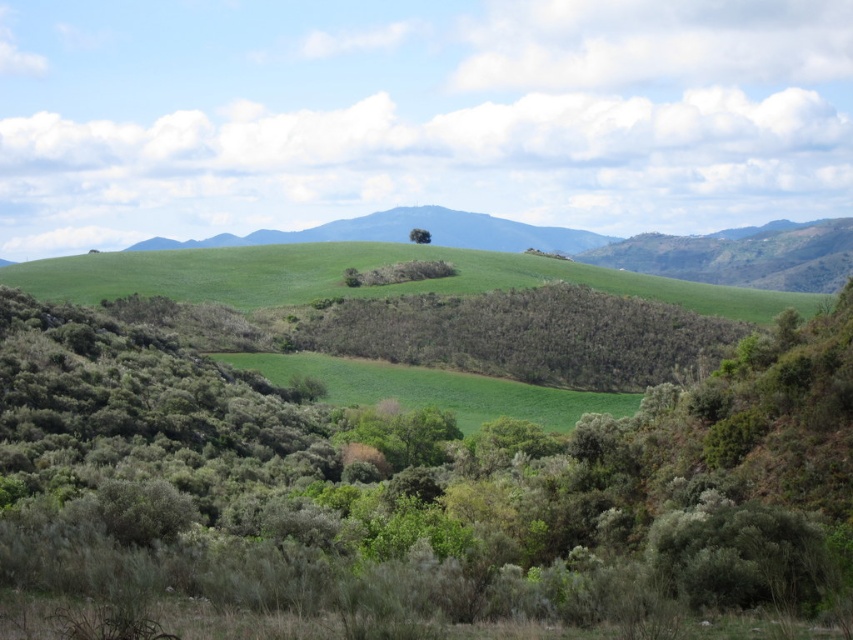
Question: Which of the following is the farthest from the observer?

Choices:
 (A) green leafy tree at center
 (B) green grassy hill at center
 (C) green leafy shrub at center
 (D) green grassy field at center

Answer: (B)

Question: Is green leafy shrub at center bigger than green grassy field at center?

Choices:
 (A) yes
 (B) no

Answer: (A)

Question: Can you confirm if green leafy shrub at center is positioned above green grassy field at center?

Choices:
 (A) no
 (B) yes

Answer: (B)

Question: Does green leafy shrub at center appear on the left side of green grassy field at center?

Choices:
 (A) no
 (B) yes

Answer: (A)

Question: Among these points, which one is farthest from the camera?

Choices:
 (A) click(x=77, y=314)
 (B) click(x=416, y=230)
 (C) click(x=230, y=243)

Answer: (C)

Question: Which object is positioned closest to the green leafy shrub at center?

Choices:
 (A) green leafy tree at center
 (B) green grassy hill at center
 (C) green grassy field at center

Answer: (C)